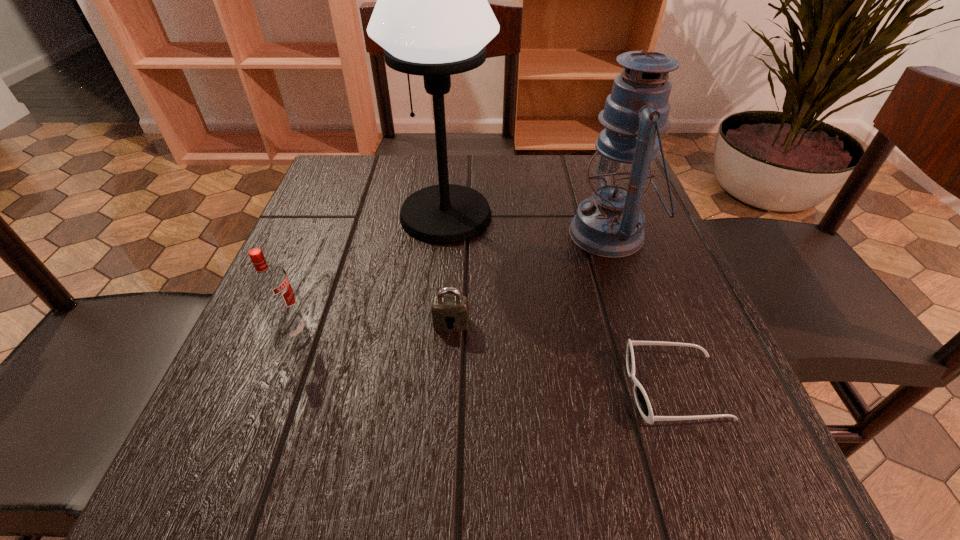
Find the location of a particular element. The width and height of the screenshot is (960, 540). free space between the table lamp and the padlock is located at coordinates (448, 269).

The image size is (960, 540). What are the coordinates of `vacant area that lies between the lantern and the nearest object` in the screenshot? It's located at (642, 311).

Where is `blank region between the padlock and the lantern`? The width and height of the screenshot is (960, 540). blank region between the padlock and the lantern is located at coordinates [x=531, y=279].

Identify the location of blank region between the leftmost object and the table lamp. (369, 274).

Identify the location of free space that is in between the table lamp and the fourth shortest object. The height and width of the screenshot is (540, 960). (528, 225).

Image resolution: width=960 pixels, height=540 pixels. What are the coordinates of `unoccupied position between the tallest object and the sunglasses` in the screenshot? It's located at (561, 302).

Find the location of a particular element. This screenshot has height=540, width=960. empty location between the nearest object and the tallest object is located at coordinates (561, 302).

Locate an element on the screen. Image resolution: width=960 pixels, height=540 pixels. vacant region between the shortest object and the vodka is located at coordinates (483, 360).

Point out which object is positioned as the second nearest to the tallest object. Please provide its 2D coordinates. Your answer should be formatted as a tuple, i.e. [(x, y)], where the tuple contains the x and y coordinates of a point satisfying the conditions above.

[(450, 313)]

This screenshot has width=960, height=540. What are the coordinates of `the third closest object to the shortest object` in the screenshot? It's located at (432, 17).